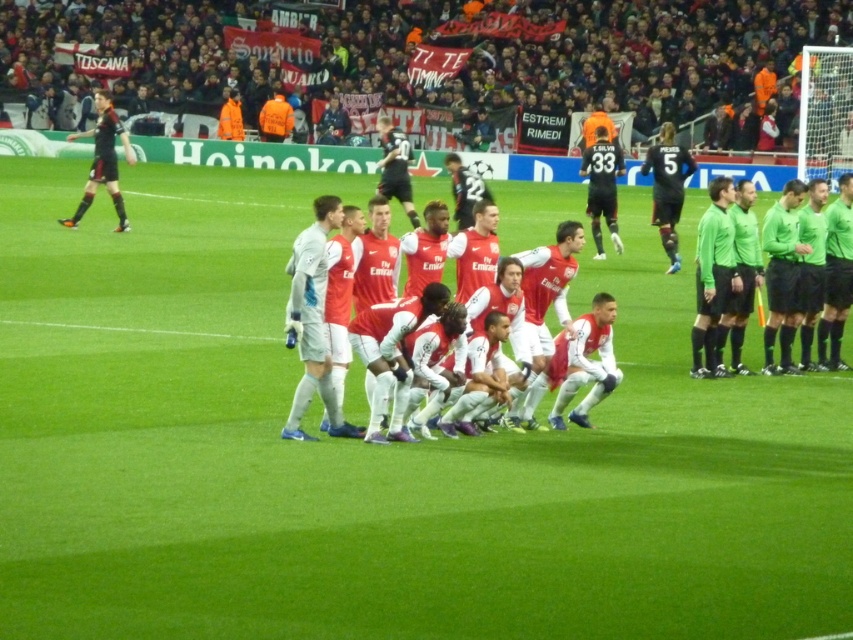
Question: Can you confirm if black matte jersey at right is smaller than orange reflective vest at center?

Choices:
 (A) yes
 (B) no

Answer: (A)

Question: In this image, where is green jersey at right located relative to matte black jersey at left?

Choices:
 (A) above
 (B) below

Answer: (B)

Question: Which point is closer to the camera?

Choices:
 (A) orange reflective vest at center
 (B) black jersey at center

Answer: (B)

Question: Does red matte jersey at center appear on the right side of green matte referee uniforms at right?

Choices:
 (A) no
 (B) yes

Answer: (A)

Question: Which point is farther from the camera taking this photo?

Choices:
 (A) (383, 170)
 (B) (669, 182)

Answer: (A)

Question: Which object is farther from the camera taking this photo?

Choices:
 (A) white matte jersey at center
 (B) green matte referee uniforms at right
 (C) orange reflective jacket at upper center
 (D) black matte jersey at right

Answer: (C)